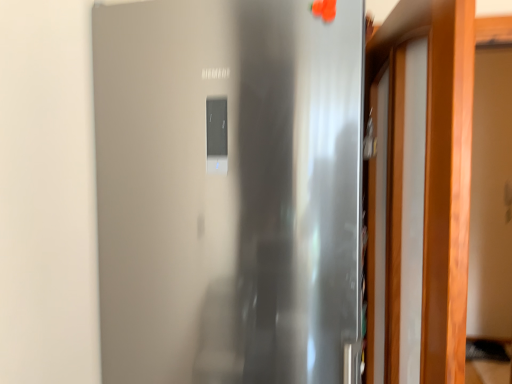
Question: From the image's perspective, is wooden door at right, the first door when ordered from right to left, positioned above or below stainless steel refrigerator at center, arranged as the 1th door when viewed from the left?

Choices:
 (A) above
 (B) below

Answer: (A)

Question: In terms of height, does wooden door at right, the first door when ordered from right to left, look taller or shorter compared to stainless steel refrigerator at center, arranged as the 1th door when viewed from the left?

Choices:
 (A) short
 (B) tall

Answer: (A)

Question: Does point pos(433,175) appear closer or farther from the camera than point pos(323,336)?

Choices:
 (A) farther
 (B) closer

Answer: (B)

Question: From the image's perspective, relative to wooden door at right, the first door when ordered from right to left, is stainless steel refrigerator at center, arranged as the 1th door when viewed from the left, above or below?

Choices:
 (A) above
 (B) below

Answer: (B)

Question: Considering the positions of stainless steel refrigerator at center, arranged as the 1th door when viewed from the left, and wooden door at right, the first door when ordered from right to left, in the image, is stainless steel refrigerator at center, arranged as the 1th door when viewed from the left, taller or shorter than wooden door at right, the first door when ordered from right to left,?

Choices:
 (A) tall
 (B) short

Answer: (A)

Question: Is stainless steel refrigerator at center, which ranks as the second door in right-to-left order, in front of or behind wooden door at right, the first door when ordered from right to left, in the image?

Choices:
 (A) behind
 (B) front

Answer: (A)

Question: Is stainless steel refrigerator at center, arranged as the 1th door when viewed from the left, to the left or to the right of wooden door at right, positioned as the second door in left-to-right order, in the image?

Choices:
 (A) left
 (B) right

Answer: (A)